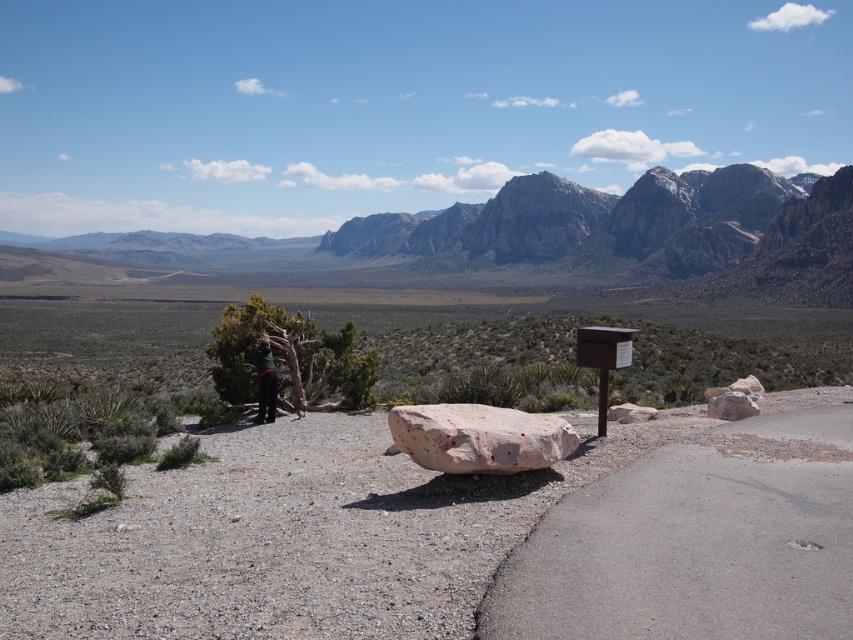
Question: Which is nearer to the dark green fabric at center?

Choices:
 (A) rusty stone boulder at right
 (B) pink polished rock at center

Answer: (B)

Question: Does rocky gray mountains at upper center appear on the left side of pink polished rock at center?

Choices:
 (A) yes
 (B) no

Answer: (A)

Question: Does rocky gray mountains at upper center have a lesser width compared to pink polished rock at center?

Choices:
 (A) yes
 (B) no

Answer: (B)

Question: Which object is the closest to the pink polished rock at center?

Choices:
 (A) rusty stone boulder at right
 (B) dark green fabric at center

Answer: (A)

Question: Which object is the farthest from the dark green fabric at center?

Choices:
 (A) pink polished rock at center
 (B) rusty stone boulder at right
 (C) rocky gray mountains at upper center

Answer: (C)

Question: Is rocky gray mountains at upper center positioned at the back of rusty stone boulder at right?

Choices:
 (A) no
 (B) yes

Answer: (B)